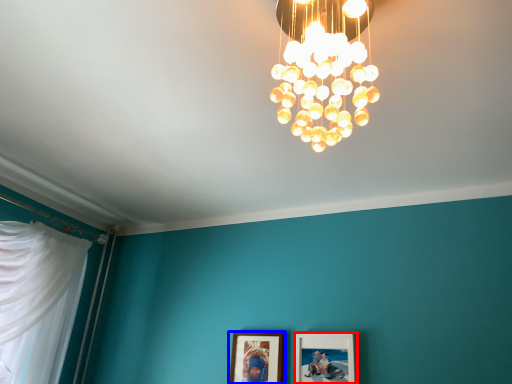
Question: Which of the following is the farthest to the observer, picture frame (highlighted by a red box) or picture frame (highlighted by a blue box)?

Choices:
 (A) picture frame
 (B) picture frame

Answer: (B)